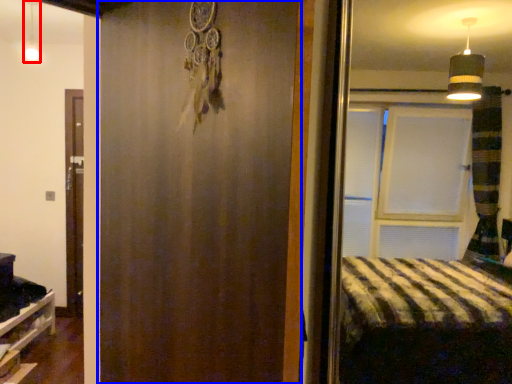
Question: Which object appears farthest to the camera in this image, light fixture (highlighted by a red box) or barn door (highlighted by a blue box)?

Choices:
 (A) light fixture
 (B) barn door

Answer: (A)